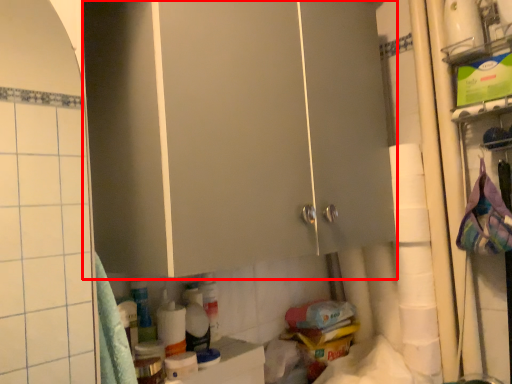
Question: Considering the relative positions of cabinetry (annotated by the red box) and toilet paper in the image provided, where is cabinetry (annotated by the red box) located with respect to the staircase?

Choices:
 (A) right
 (B) left

Answer: (B)